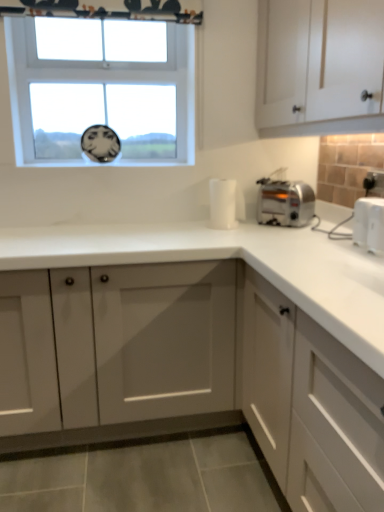
Image resolution: width=384 pixels, height=512 pixels. Identify the location of empty space that is ontop of white matte cabinet at center, which is the second cabinetry in bottom-to-top order (from a real-world perspective). (112, 232).